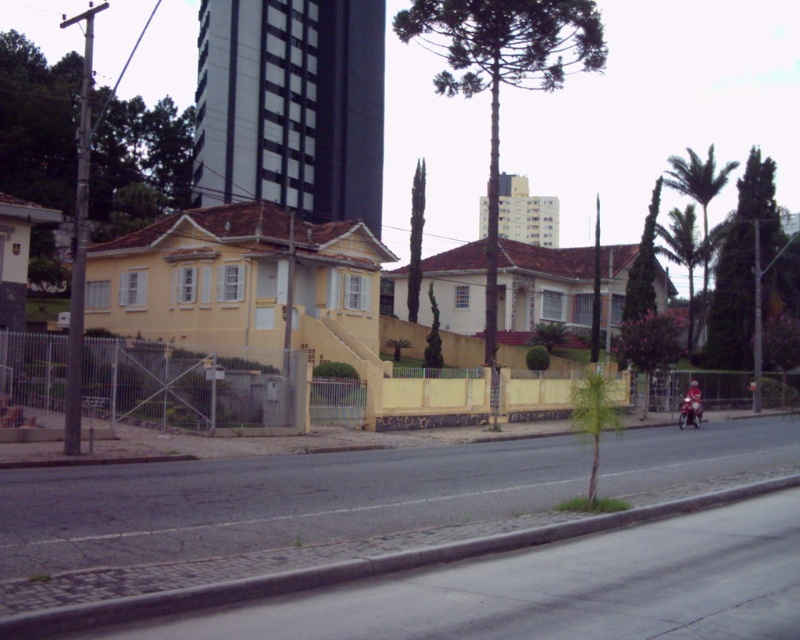
You are standing at the point with coordinates (690, 406) in the image. What object are you directly facing?

The point at (690, 406) corresponds to the metallic silver motorcycle at center, so you are directly facing the metallic silver motorcycle at center.